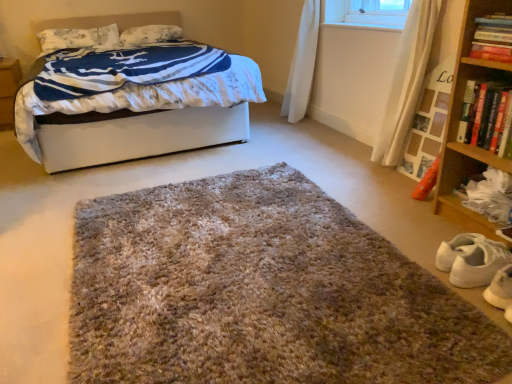
Question: Does white floral fabric pillow at upper left, positioned as the first pillow in left-to-right order, appear on the right side of hardcover book at upper right, the second book ordered from the bottom?

Choices:
 (A) no
 (B) yes

Answer: (A)

Question: Considering the relative sizes of white floral fabric pillow at upper left, the 2th pillow viewed from the right, and hardcover book at upper right, the 1th book viewed from the top, in the image provided, is white floral fabric pillow at upper left, the 2th pillow viewed from the right, thinner than hardcover book at upper right, the 1th book viewed from the top,?

Choices:
 (A) no
 (B) yes

Answer: (A)

Question: Is white floral fabric pillow at upper left, positioned as the first pillow in left-to-right order, not inside hardcover book at upper right, the 1th book viewed from the top?

Choices:
 (A) no
 (B) yes

Answer: (B)

Question: From the image's perspective, is white floral fabric pillow at upper left, positioned as the first pillow in left-to-right order, over hardcover book at upper right, the second book ordered from the bottom?

Choices:
 (A) yes
 (B) no

Answer: (A)

Question: From the image's perspective, is white floral fabric pillow at upper left, positioned as the first pillow in left-to-right order, under hardcover book at upper right, the 1th book viewed from the top?

Choices:
 (A) yes
 (B) no

Answer: (B)

Question: Choose the correct answer: Is white soft bed at upper left inside brown cardboard at left or outside it?

Choices:
 (A) inside
 (B) outside

Answer: (B)

Question: From the image's perspective, is white soft bed at upper left located above or below brown cardboard at left?

Choices:
 (A) below
 (B) above

Answer: (B)

Question: Considering the relative positions of white soft bed at upper left and brown cardboard at left in the image provided, is white soft bed at upper left to the left or to the right of brown cardboard at left?

Choices:
 (A) right
 (B) left

Answer: (A)

Question: Is point (87, 130) positioned closer to the camera than point (1, 97)?

Choices:
 (A) closer
 (B) farther

Answer: (A)

Question: From a real-world perspective, is wooden bookshelf at right positioned above or below wooden shelf at lower right?

Choices:
 (A) below
 (B) above

Answer: (B)

Question: Would you say wooden bookshelf at right is inside or outside wooden shelf at lower right?

Choices:
 (A) outside
 (B) inside

Answer: (A)

Question: From the image's perspective, is wooden bookshelf at right positioned above or below wooden shelf at lower right?

Choices:
 (A) above
 (B) below

Answer: (A)

Question: From their relative heights in the image, would you say wooden bookshelf at right is taller or shorter than wooden shelf at lower right?

Choices:
 (A) short
 (B) tall

Answer: (B)

Question: Based on their positions, is white soft bed at upper left located to the left or right of wooden shelf at lower right?

Choices:
 (A) right
 (B) left

Answer: (B)

Question: Is white soft bed at upper left inside or outside of wooden shelf at lower right?

Choices:
 (A) outside
 (B) inside

Answer: (A)